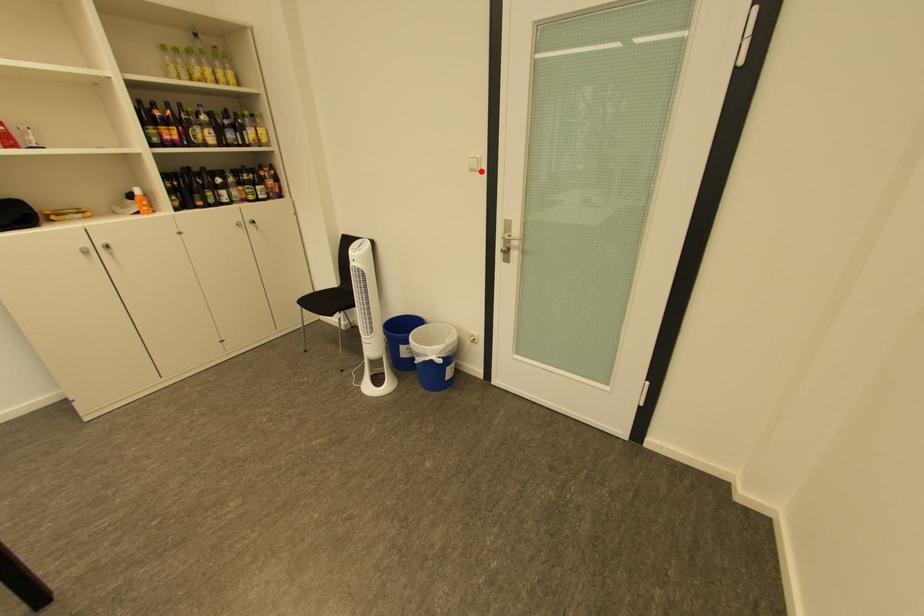
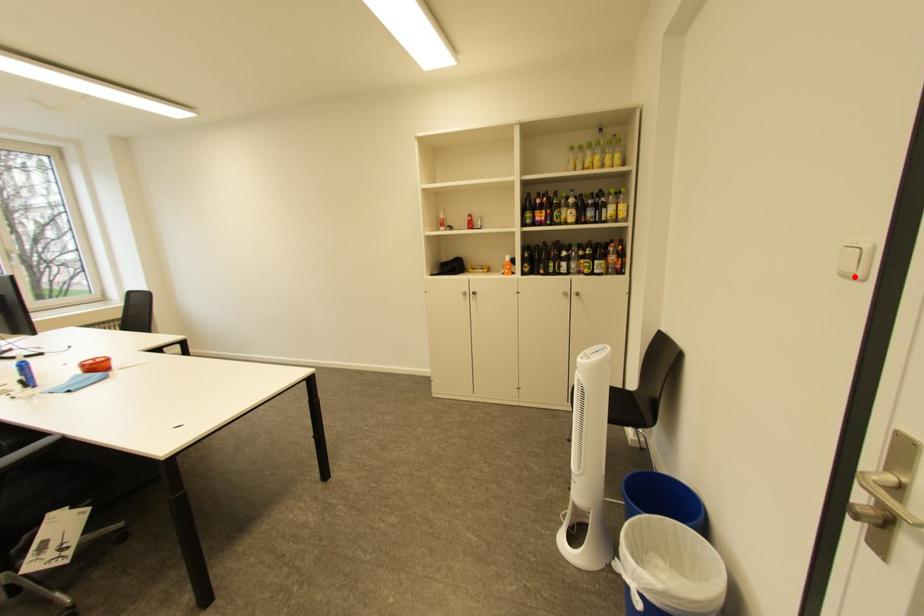
I am providing you with two images of the same scene from different viewpoints. A red point is marked on the first image and another point is marked on the second image. Is the red point in image1 aligned with the point shown in image2?

Yes